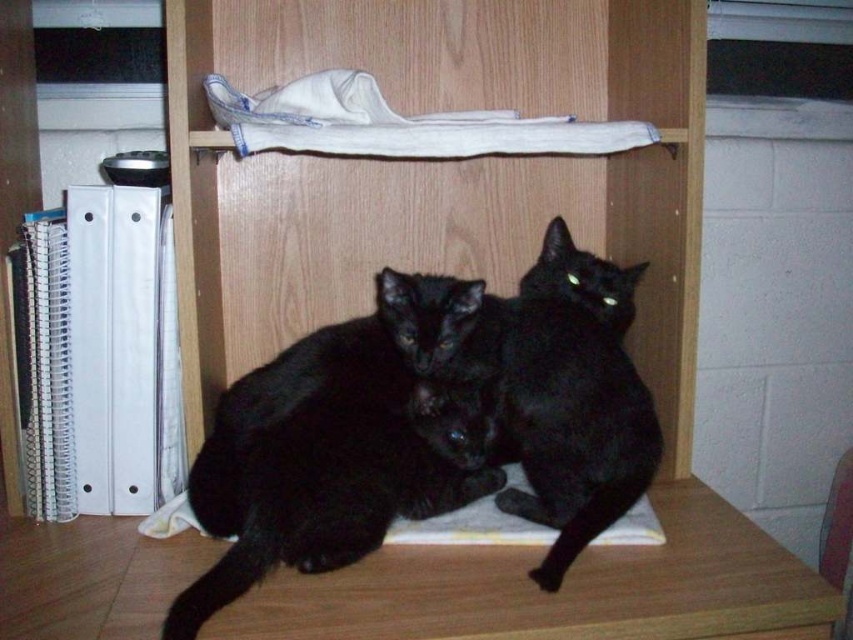
Does wooden bookshelf at center lie in front of black matte fur cat at center?

That is False.

The image size is (853, 640). What do you see at coordinates (433, 172) in the screenshot?
I see `wooden bookshelf at center` at bounding box center [433, 172].

Which is in front, point (456, 218) or point (445, 420)?

Point (445, 420) is more forward.

The width and height of the screenshot is (853, 640). Find the location of `wooden bookshelf at center`. wooden bookshelf at center is located at coordinates (433, 172).

Locate an element on the screen. wooden table at lower center is located at coordinates (560, 589).

This screenshot has height=640, width=853. Describe the element at coordinates (560, 589) in the screenshot. I see `wooden table at lower center` at that location.

Locate an element on the screen. This screenshot has height=640, width=853. wooden table at lower center is located at coordinates (560, 589).

Is black matte fur cat at center to the left of black fur cat at center from the viewer's perspective?

Correct, you'll find black matte fur cat at center to the left of black fur cat at center.

At what (x,y) coordinates should I click in order to perform the action: click on black matte fur cat at center. Please return your answer as a coordinate pair (x, y). The height and width of the screenshot is (640, 853). Looking at the image, I should click on (341, 444).